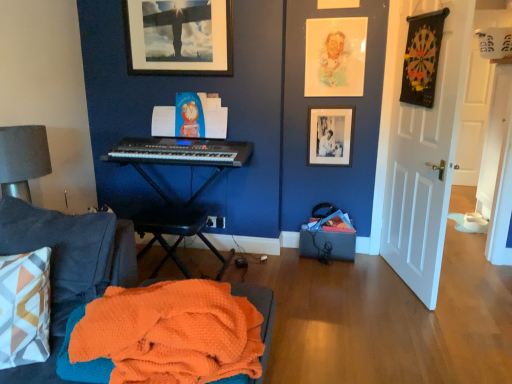
At what (x,y) coordinates should I click in order to perform the action: click on vacant space to the left of white matte door at right. Please return your answer as a coordinate pair (x, y). This screenshot has width=512, height=384. Looking at the image, I should click on (341, 285).